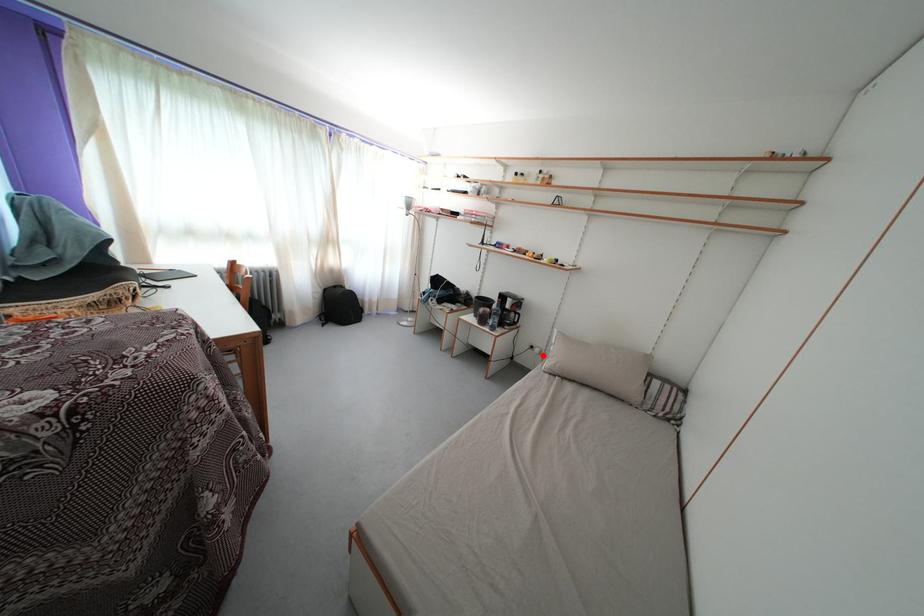
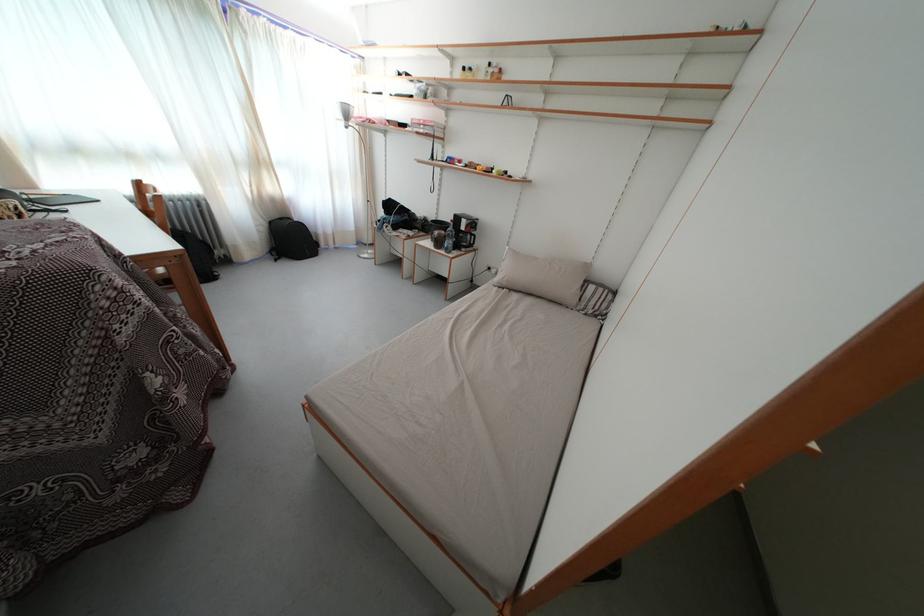
Question: A red point is marked in image1. In image2, is the corresponding 3D point closer to the camera or farther? Reply with the corresponding letter.

Choices:
 (A) The corresponding 3D point is closer.
 (B) The corresponding 3D point is farther.

Answer: (B)